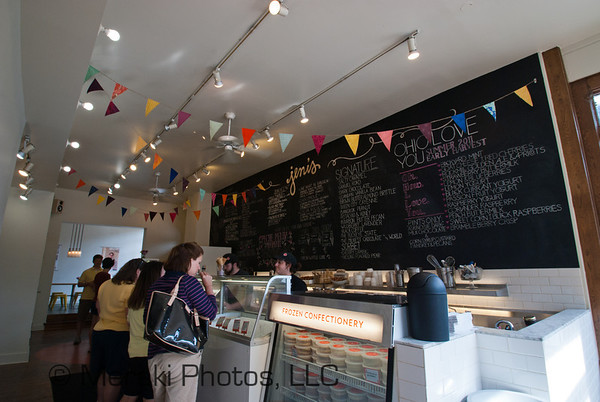
The image size is (600, 402). I want to click on display case, so click(311, 346).